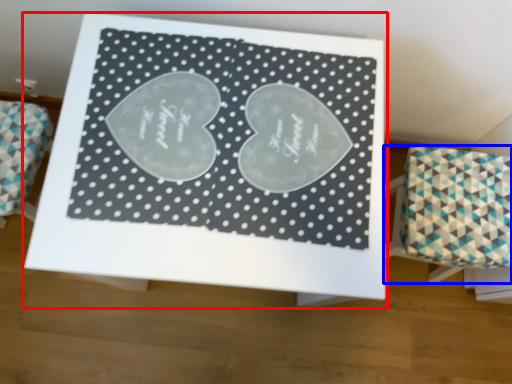
Question: Which object is further to the camera taking this photo, table (highlighted by a red box) or furniture (highlighted by a blue box)?

Choices:
 (A) table
 (B) furniture

Answer: (B)